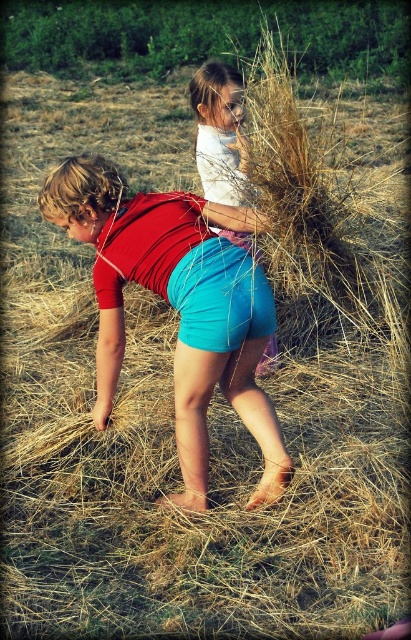
Image resolution: width=411 pixels, height=640 pixels. What do you see at coordinates (177, 307) in the screenshot?
I see `matte blue shorts at center` at bounding box center [177, 307].

Between point (138, 268) and point (221, 68), which one is positioned behind?

The point (221, 68) is behind.

Measure the distance between point (244, 419) and camera.

They are 3.56 meters apart.

Locate an element on the screen. The height and width of the screenshot is (640, 411). matte blue shorts at center is located at coordinates (177, 307).

Does teal fabric shorts at center have a larger size compared to matte white shirt at upper center?

No, teal fabric shorts at center is not bigger than matte white shirt at upper center.

Does teal fabric shorts at center appear over matte white shirt at upper center?

Incorrect, teal fabric shorts at center is not positioned above matte white shirt at upper center.

Between point (212, 285) and point (212, 74), which one is positioned behind?

Positioned behind is point (212, 74).

This screenshot has width=411, height=640. What are the coordinates of `teal fabric shorts at center` in the screenshot? It's located at (221, 296).

Is matte blue shorts at center to the left of teal fabric shorts at center from the viewer's perspective?

A: Yes, matte blue shorts at center is to the left of teal fabric shorts at center.

Does matte blue shorts at center come in front of teal fabric shorts at center?

No, it is behind teal fabric shorts at center.

This screenshot has width=411, height=640. I want to click on matte blue shorts at center, so click(x=177, y=307).